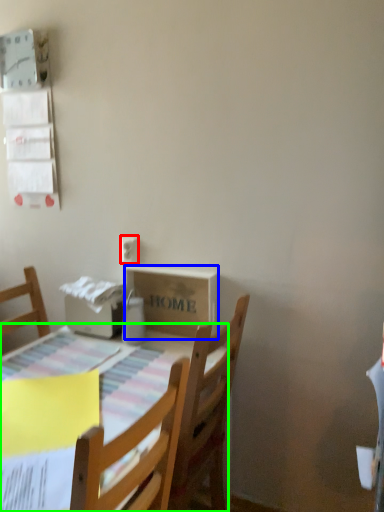
Question: Which object is positioned closest to electric outlet (highlighted by a red box)? Select from cardboard box (highlighted by a blue box) and table (highlighted by a green box).

Choices:
 (A) cardboard box
 (B) table

Answer: (A)